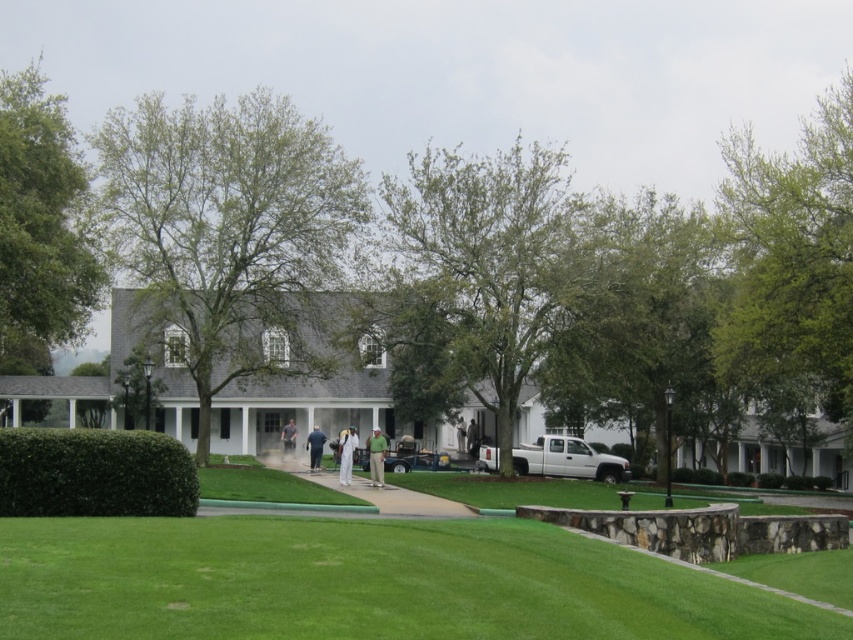
Question: Is green grass at lower center further to camera compared to white matte truck at center?

Choices:
 (A) yes
 (B) no

Answer: (B)

Question: From the image, what is the correct spatial relationship of dark blue jeans at center in relation to white matte pants at center?

Choices:
 (A) left
 (B) right

Answer: (A)

Question: Is green grass at lower center bigger than light gray fabric jacket at center?

Choices:
 (A) yes
 (B) no

Answer: (A)

Question: Estimate the real-world distances between objects in this image. Which object is farther from the green grass at lower center?

Choices:
 (A) light gray fabric jacket at center
 (B) green leafy hedge at lower left

Answer: (A)

Question: Which object is the closest to the white cotton shirt at center?

Choices:
 (A) white matte suit at center
 (B) light gray fabric jacket at center

Answer: (B)

Question: Among these points, which one is nearest to the camera?

Choices:
 (A) (368, 458)
 (B) (291, 436)

Answer: (A)